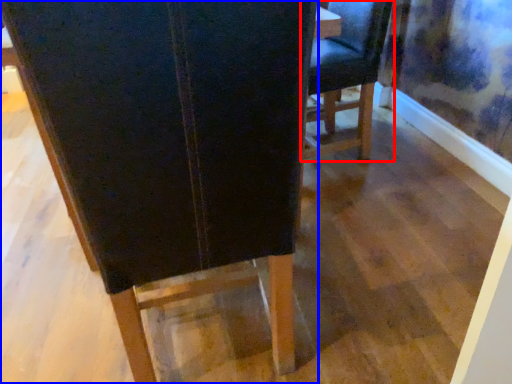
Question: Which point is further to the camera, chair (highlighted by a red box) or chair (highlighted by a blue box)?

Choices:
 (A) chair
 (B) chair

Answer: (A)